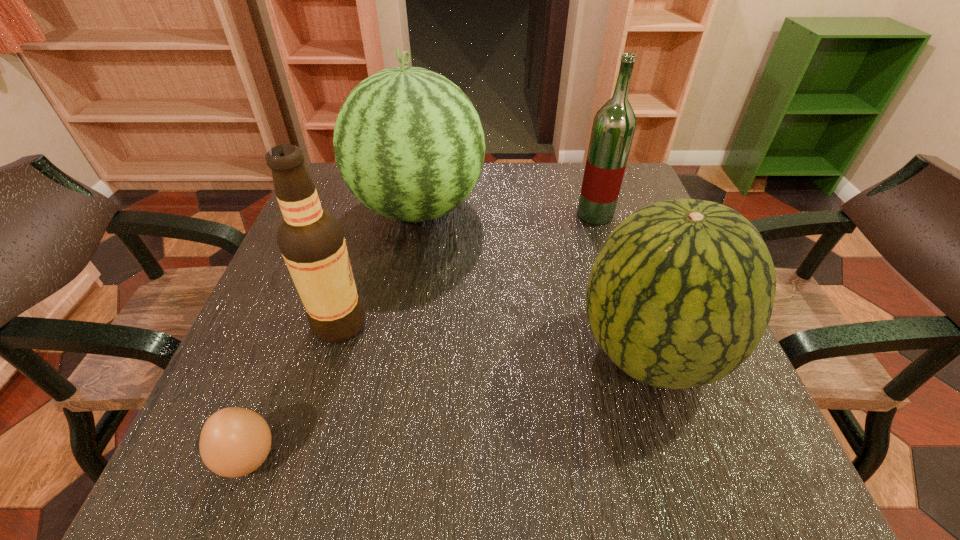
The height and width of the screenshot is (540, 960). Find the location of `free space between the liquor and the left watermelon`. free space between the liquor and the left watermelon is located at coordinates (507, 212).

The width and height of the screenshot is (960, 540). I want to click on free space between the shorter watermelon and the shortest object, so click(x=449, y=406).

This screenshot has height=540, width=960. Find the location of `free space that is in between the taller watermelon and the right watermelon`. free space that is in between the taller watermelon and the right watermelon is located at coordinates (534, 281).

Locate an element on the screen. unoccupied position between the boiled egg and the liquor is located at coordinates (422, 337).

Find the location of a particular element. This screenshot has width=960, height=540. free space between the right watermelon and the left watermelon is located at coordinates (534, 281).

Where is `free space between the shortest object and the alcohol`? This screenshot has width=960, height=540. free space between the shortest object and the alcohol is located at coordinates (295, 391).

This screenshot has height=540, width=960. In order to click on unoccupied position between the alcohol and the fourth tallest object in this screenshot , I will do `click(494, 339)`.

Where is `free space between the alcohol and the liquor`? This screenshot has height=540, width=960. free space between the alcohol and the liquor is located at coordinates (468, 269).

This screenshot has height=540, width=960. I want to click on object that is the fourth closest to the nearest object, so click(613, 128).

In order to click on the second closest object to the liquor in this screenshot , I will do `click(680, 294)`.